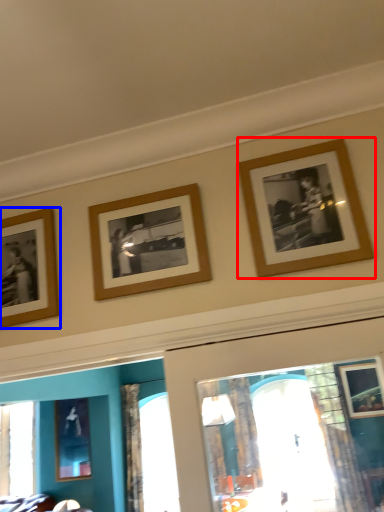
Question: Among these objects, which one is farthest to the camera, picture frame (highlighted by a red box) or picture frame (highlighted by a blue box)?

Choices:
 (A) picture frame
 (B) picture frame

Answer: (B)